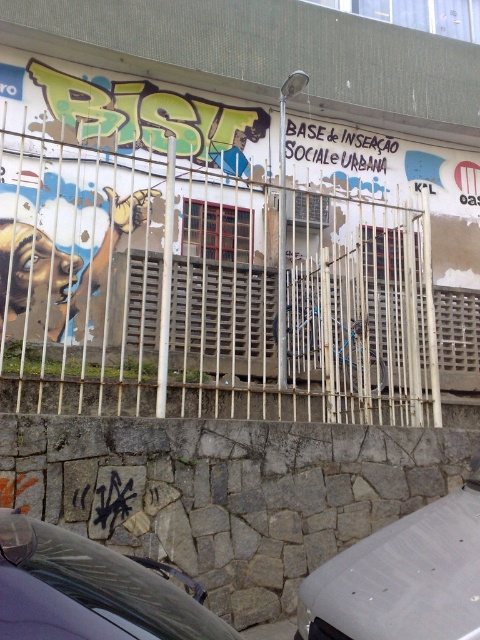
You are a delivery person trying to deliver a package to the address located at coordinates point 0.455, 0.433. The rusty metal fence at center is blocking your path. Can you go around it to reach the address?

The position of rusty metal fence at center is at point (x=207, y=291), so the address is exactly where the rusty metal fence at center is located. You cannot go around it because the fence is blocking the path to the address.

You are a delivery driver who needs to park your car that is 4 meters long. You see the shiny black car at lower left and the rusty metal fence at center. Can you park your car between them without touching either?

The distance between the rusty metal fence at center and the shiny black car at lower left is 4.11 meters. Since your car is 4 meters long, there is enough space to park between them without touching either.